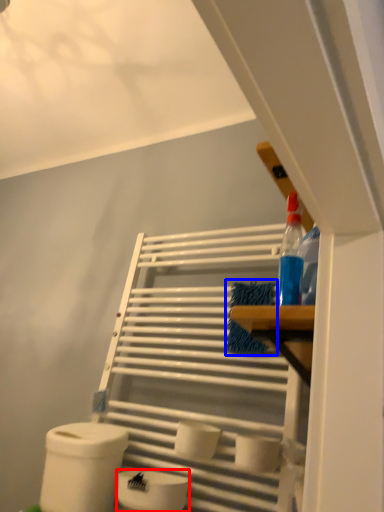
Question: Which of the following is the closest to the observer, toilet paper (highlighted by a red box) or material (highlighted by a blue box)?

Choices:
 (A) toilet paper
 (B) material

Answer: (A)